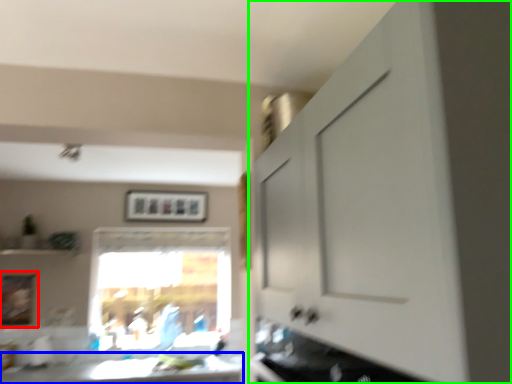
Question: Estimate the real-world distances between objects in this image. Which object is farther from picture frame (highlighted by a red box), counter top (highlighted by a blue box) or cabinetry (highlighted by a green box)?

Choices:
 (A) counter top
 (B) cabinetry

Answer: (B)